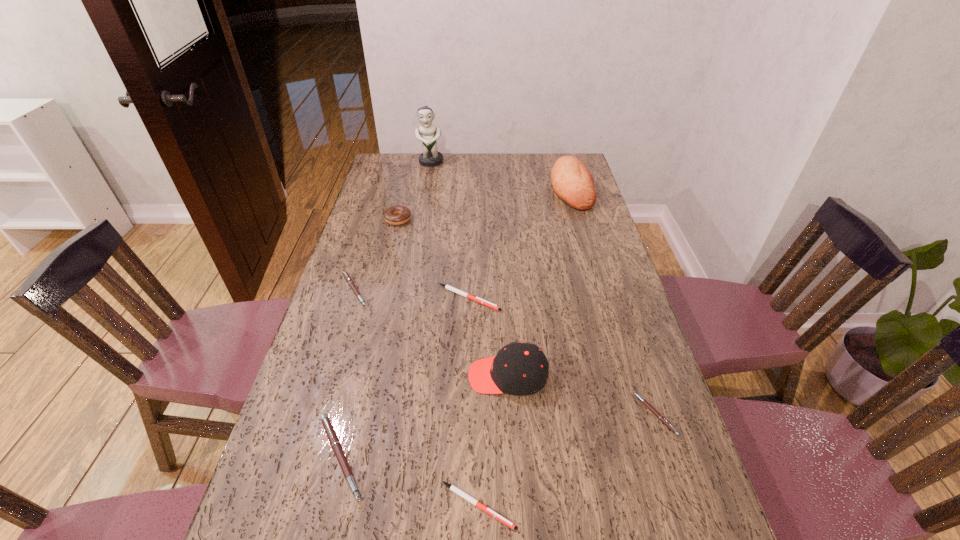
Where is `pen located in the right edge section of the desktop`? The image size is (960, 540). pen located in the right edge section of the desktop is located at coordinates (651, 408).

Where is `object located in the far right corner section of the desktop`? The height and width of the screenshot is (540, 960). object located in the far right corner section of the desktop is located at coordinates (572, 182).

Where is `vacant space at the far edge of the desktop`? The image size is (960, 540). vacant space at the far edge of the desktop is located at coordinates (450, 178).

The image size is (960, 540). I want to click on vacant position at the left edge of the desktop, so click(362, 244).

In the image, there is a desktop. Identify the location of vacant area at the right edge. Image resolution: width=960 pixels, height=540 pixels. (595, 314).

Where is `free space at the far left corner of the desktop`? free space at the far left corner of the desktop is located at coordinates (397, 170).

Where is `unoccupied area between the nearer white pen and the sixth shortest object`? unoccupied area between the nearer white pen and the sixth shortest object is located at coordinates (438, 362).

You are a GUI agent. You are given a task and a screenshot of the screen. Output one action in this format:
    pyautogui.click(x=<x>, y=<y>)
    Task: Click on the empty space that is in between the doughnut and the green figurine
    
    Given the screenshot: What is the action you would take?
    pyautogui.click(x=415, y=191)

Where is `free space between the green figurine and the rightmost pen`? The width and height of the screenshot is (960, 540). free space between the green figurine and the rightmost pen is located at coordinates (543, 288).

Locate an element on the screen. empty location between the second biggest pink pen and the tallest pen is located at coordinates (347, 373).